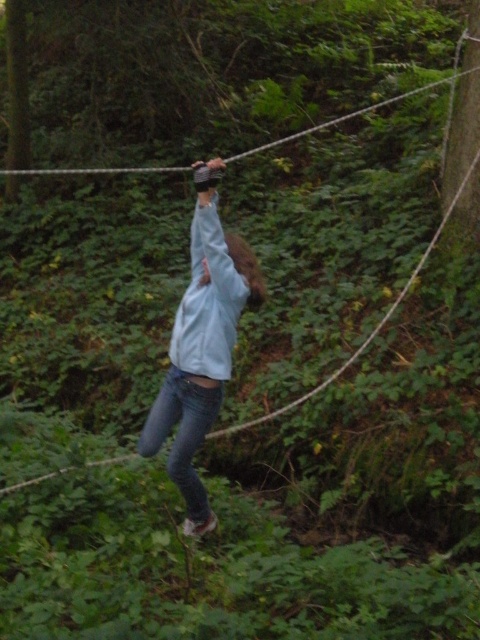
You are an observer looking at the image of a person balancing on a slackline. There is a point marked at coordinates (202, 344). What object or feature does this point correspond to in the scene?

The point at coordinates (202, 344) corresponds to the light blue fabric at center.

You are a photographer trying to capture the perfect shot of the person on the slackline. You notice the light blue fabric at center and denim at center. Which one should you focus on if you want to highlight the part of their outfit that is on the right side?

The light blue fabric at center is positioned on the right side of denim at center, so focusing on the light blue fabric at center will highlight the part of their outfit that is on the right side.

You are a photographer trying to capture the perfect shot of the person on the slackline. You notice the light blue fabric at center and denim at center. Which part of the person should you focus on to ensure the larger object is in sharp focus?

The light blue fabric at center is larger in size than denim at center, so you should focus on the light blue fabric at center to ensure the larger object is in sharp focus.